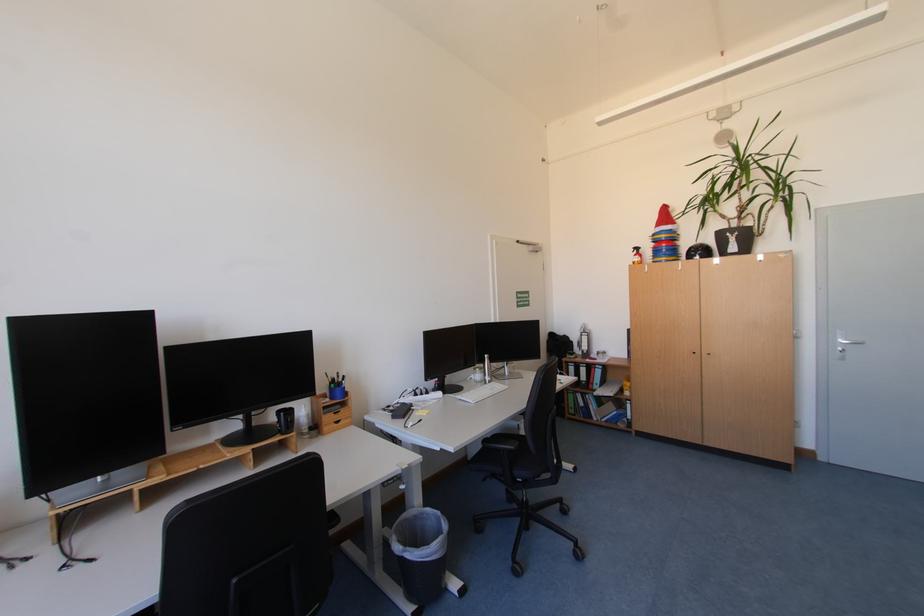
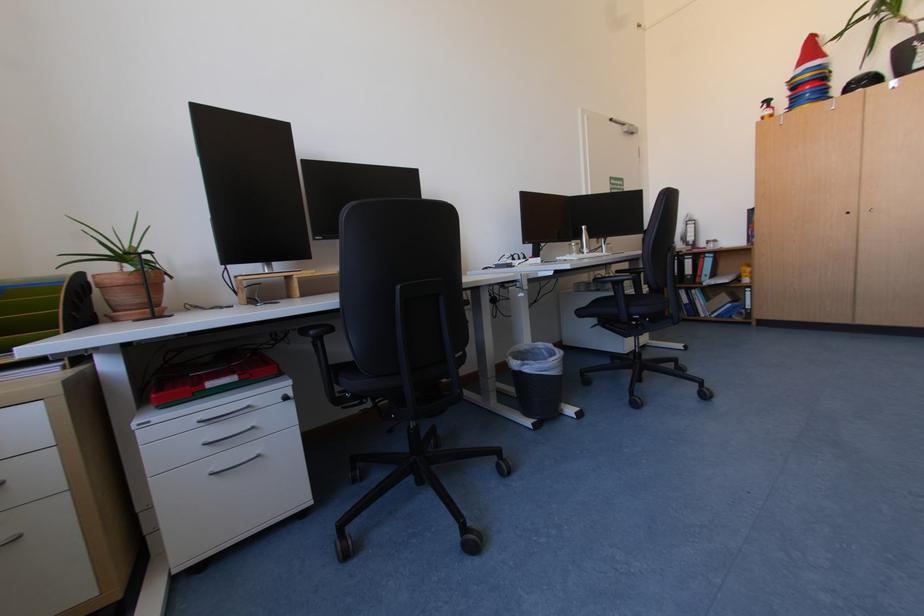
Question: The images are taken continuously from a first-person perspective. In which direction is your viewpoint rotating?

Choices:
 (A) Left
 (B) Right
 (C) Up
 (D) Down

Answer: (A)